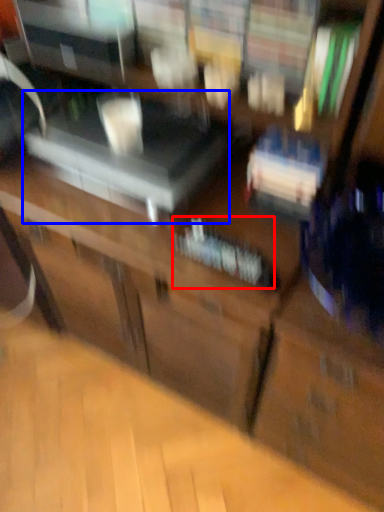
Question: Among these objects, which one is farthest to the camera, book (highlighted by a red box) or furniture (highlighted by a blue box)?

Choices:
 (A) book
 (B) furniture

Answer: (B)